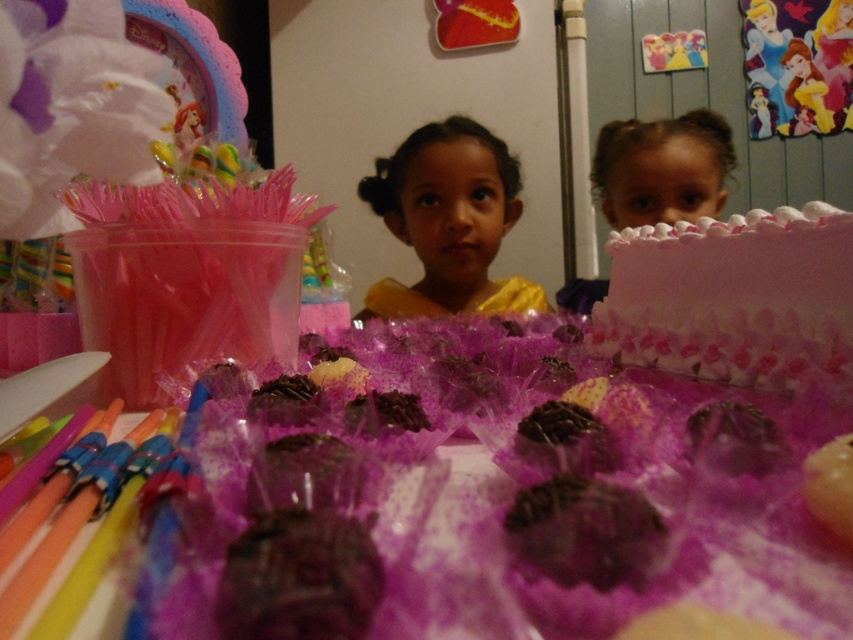
Can you confirm if pink frosted cake at right is shorter than yellow satin dress at center?

Correct, pink frosted cake at right is not as tall as yellow satin dress at center.

Does pink frosted cake at right have a greater width compared to yellow satin dress at center?

In fact, pink frosted cake at right might be narrower than yellow satin dress at center.

Which is in front, point (640, 273) or point (442, 275)?

Point (640, 273) is in front.

I want to click on pink frosted cake at right, so click(734, 298).

Is pink frosted cake at right shorter than smooth pink cake at upper right?

Yes.

Is point (717, 252) positioned behind point (706, 109)?

No.

Identify the location of pink frosted cake at right. (734, 298).

Between yellow satin dress at center and chocolate-coated truffle at center, which one has less height?

chocolate-coated truffle at center

Can you confirm if yellow satin dress at center is shorter than chocolate-coated truffle at center?

No, yellow satin dress at center is not shorter than chocolate-coated truffle at center.

Does point (376, 189) lie behind point (368, 579)?

Yes.

This screenshot has width=853, height=640. Identify the location of yellow satin dress at center. (448, 221).